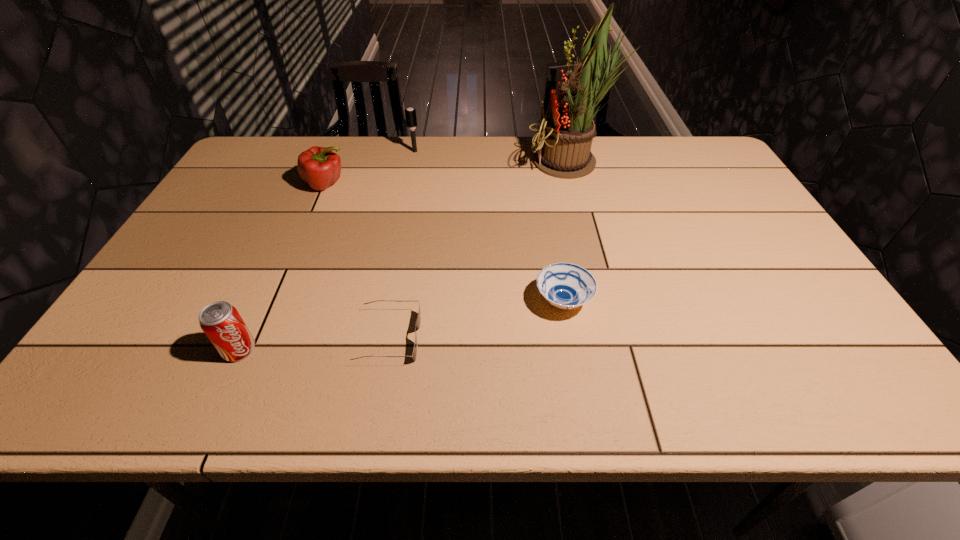
Find the location of `vacant space that's between the flower arrangement and the sunglasses`. vacant space that's between the flower arrangement and the sunglasses is located at coordinates (480, 250).

Locate an element on the screen. The height and width of the screenshot is (540, 960). vacant point located between the bell pepper and the sunglasses is located at coordinates (357, 261).

The image size is (960, 540). Find the location of `object that stands as the fifth closest to the flower arrangement`. object that stands as the fifth closest to the flower arrangement is located at coordinates (220, 321).

In order to click on object that ranks as the second closest to the sunglasses in this screenshot , I will do `click(564, 285)`.

Find the location of `free space that satisfies the following two spatial constraints: 1. on the back side of the bell pepper; 2. on the right side of the hairbrush`. free space that satisfies the following two spatial constraints: 1. on the back side of the bell pepper; 2. on the right side of the hairbrush is located at coordinates (340, 151).

The width and height of the screenshot is (960, 540). In order to click on vacant point that satisfies the following two spatial constraints: 1. on the back side of the soda can; 2. on the right side of the fifth tallest object in this screenshot , I will do [261, 301].

Locate an element on the screen. The height and width of the screenshot is (540, 960). free region that satisfies the following two spatial constraints: 1. in front of the tallest object with the fan visible; 2. on the front side of the fifth tallest object is located at coordinates (610, 301).

Image resolution: width=960 pixels, height=540 pixels. In order to click on free space that satisfies the following two spatial constraints: 1. on the front side of the soup bowl; 2. on the front-facing side of the shortest object in this screenshot , I will do coord(569,338).